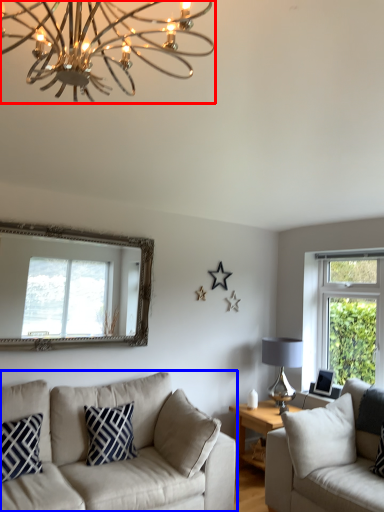
Question: Which object is closer to the camera taking this photo, lamp (highlighted by a red box) or studio couch (highlighted by a blue box)?

Choices:
 (A) lamp
 (B) studio couch

Answer: (A)